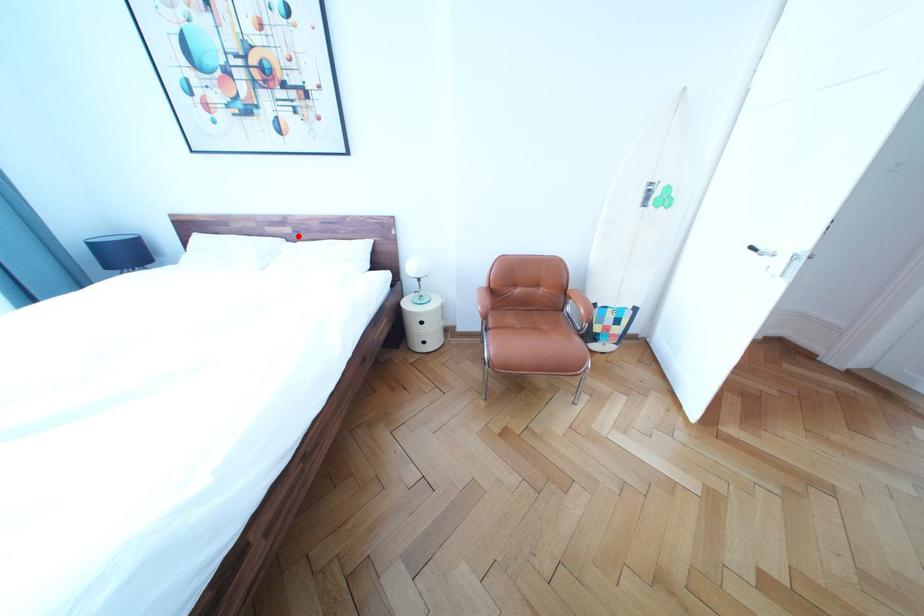
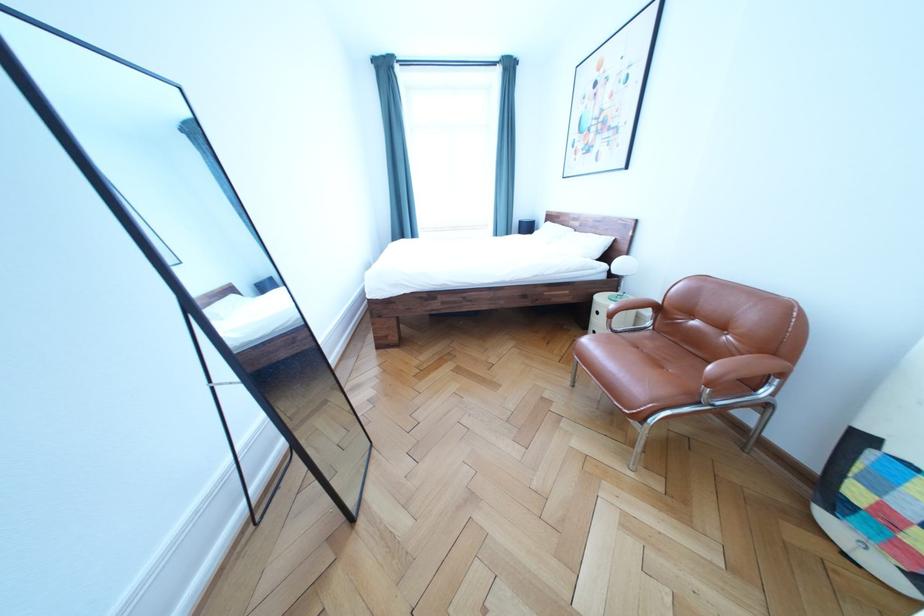
Question: A red point is marked in image1. In image2, is the corresponding 3D point closer to the camera or farther? Reply with the corresponding letter.

Choices:
 (A) The corresponding 3D point is closer.
 (B) The corresponding 3D point is farther.

Answer: (A)